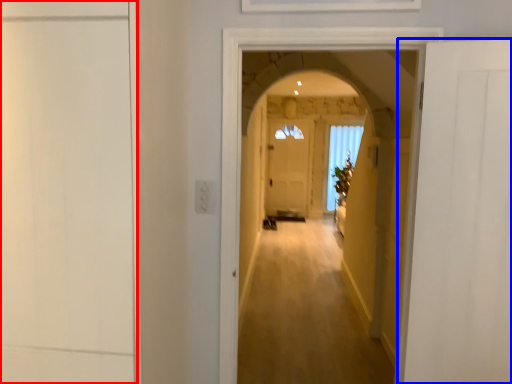
Question: Which object is further to the camera taking this photo, door (highlighted by a red box) or door (highlighted by a blue box)?

Choices:
 (A) door
 (B) door

Answer: (B)